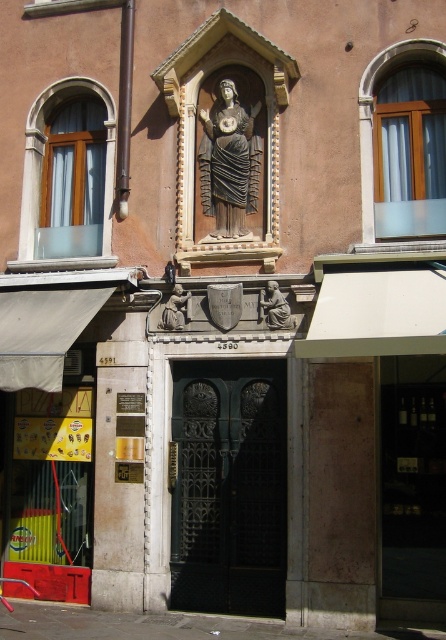
Between dark gray stone statue at center and matte gray stone statue at center, which one has less height?

matte gray stone statue at center is shorter.

Is dark gray stone statue at center positioned in front of matte gray stone statue at center?

No, it is not.

What are the coordinates of `dark gray stone statue at center` in the screenshot? It's located at (228, 161).

Find the location of `dark gray stone statue at center`. dark gray stone statue at center is located at coordinates (228, 161).

Does point (247, 205) lie behind point (176, 285)?

Yes.

Describe the element at coordinates (228, 161) in the screenshot. I see `dark gray stone statue at center` at that location.

I want to click on dark gray stone statue at center, so click(228, 161).

Is point (293, 323) positioned before point (169, 305)?

Yes, point (293, 323) is closer to viewer.

Can you confirm if matte gray stone statue at center is positioned below matte stone statue at center?

No.

You are a GUI agent. You are given a task and a screenshot of the screen. Output one action in this format:
    pyautogui.click(x=<x>, y=<y>)
    Task: Click on the matte gray stone statue at center
    This screenshot has height=640, width=446.
    Given the screenshot: What is the action you would take?
    pyautogui.click(x=276, y=307)